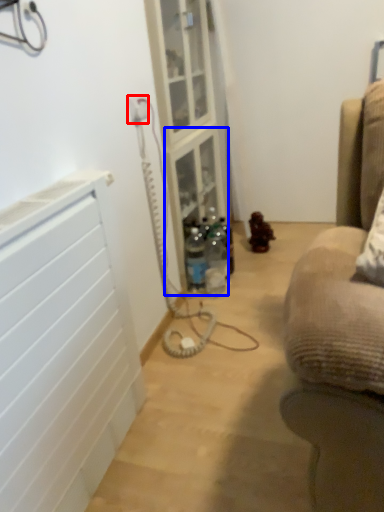
Question: Which point is further to the camera, electric outlet (highlighted by a red box) or shelf (highlighted by a blue box)?

Choices:
 (A) electric outlet
 (B) shelf

Answer: (B)